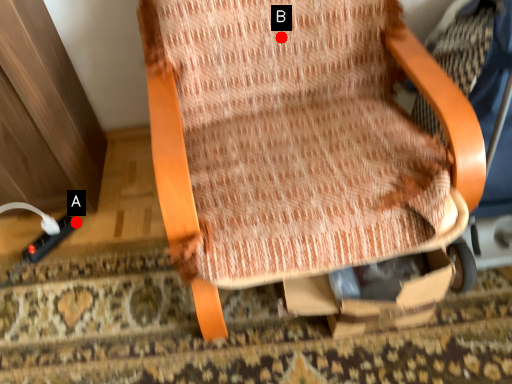
Question: Two points are circled on the image, labeled by A and B beside each circle. Which point appears farthest from the camera in this image?

Choices:
 (A) A is further
 (B) B is further

Answer: (A)